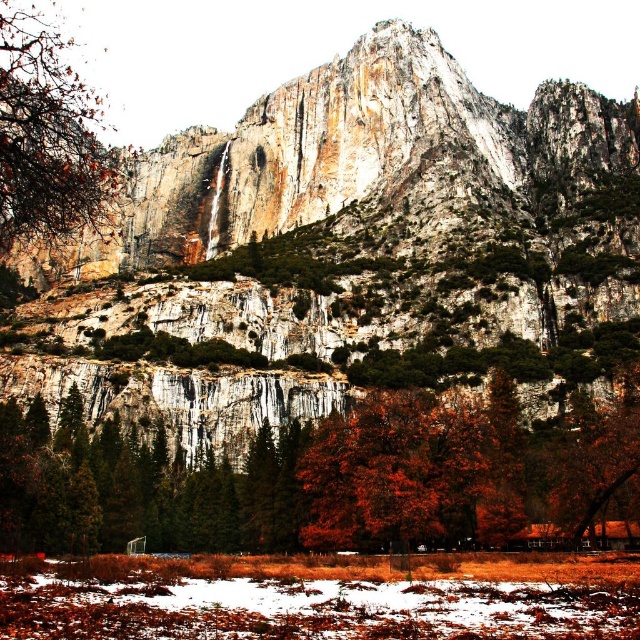
You are an artist trying to sketch the scene. You need to place the orange leafy tree at center and the smooth brown tree trunk at left accurately. Based on the description, which object is located to the left of the other?

The smooth brown tree trunk at left is positioned to the left of the orange leafy tree at center.

You are an adventurer planning to climb the rocky cliff at center and the orange leafy tree at center. Which one will require a taller ladder to reach the top?

The rocky cliff at center is taller than the orange leafy tree at center, so you will need a taller ladder for the rocky cliff at center.

You are an adventurer planning to climb the rocky cliff at center. You notice an orange leafy tree at center nearby. Which object is higher in elevation?

The rocky cliff at center is located above the orange leafy tree at center, so the rocky cliff at center is higher in elevation.